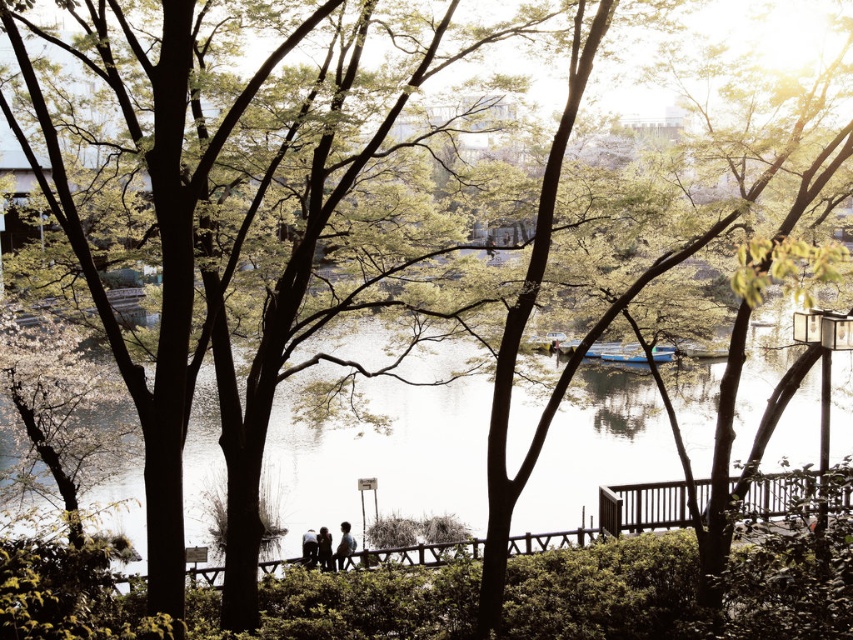
Between point (329, 540) and point (343, 564), which one is positioned behind?

Positioned behind is point (329, 540).

What do you see at coordinates (323, 548) in the screenshot?
I see `dark brown leather jacket at center` at bounding box center [323, 548].

Identify the location of dark brown leather jacket at center. (323, 548).

Can you confirm if light brown wooden bench at center is taller than dark blue jeans at center?

Yes, light brown wooden bench at center is taller than dark blue jeans at center.

Who is more forward, (335,563) or (302,556)?

Point (302,556)

The height and width of the screenshot is (640, 853). Find the location of `light brown wooden bench at center`. light brown wooden bench at center is located at coordinates (344, 545).

Who is more forward, (757,378) or (352,550)?

Point (352,550) is in front.

Between clear water at center and silhouette wooden couple at center, which one has less height?

With less height is silhouette wooden couple at center.

Describe the element at coordinates (384, 458) in the screenshot. I see `clear water at center` at that location.

This screenshot has height=640, width=853. Find the location of `clear water at center`. clear water at center is located at coordinates (384, 458).